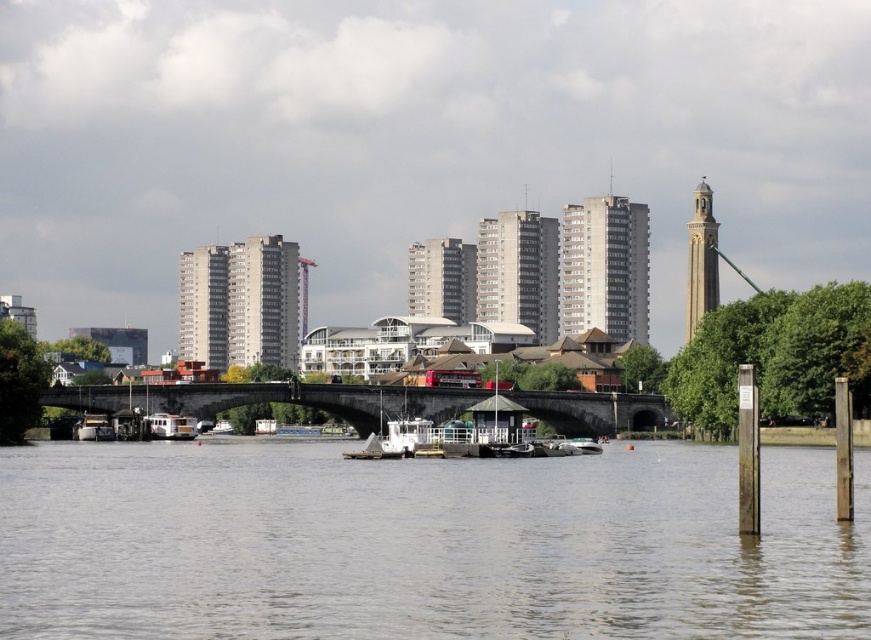
Question: Which point is farther to the camera?

Choices:
 (A) (x=325, y=404)
 (B) (x=186, y=433)
 (C) (x=395, y=566)

Answer: (A)

Question: In this image, where is stone bridge at center located relative to white matte boat at center?

Choices:
 (A) above
 (B) below

Answer: (A)

Question: Observing the image, what is the correct spatial positioning of gray water at center in reference to stone bridge at center?

Choices:
 (A) left
 (B) right

Answer: (B)

Question: Where is gray water at center located in relation to white matte boat at center in the image?

Choices:
 (A) right
 (B) left

Answer: (A)

Question: Which of the following is the closest to the observer?

Choices:
 (A) white matte boat at center
 (B) gray water at center

Answer: (B)

Question: Which of these objects is positioned closest to the gray water at center?

Choices:
 (A) stone bridge at center
 (B) white matte boat at center

Answer: (A)